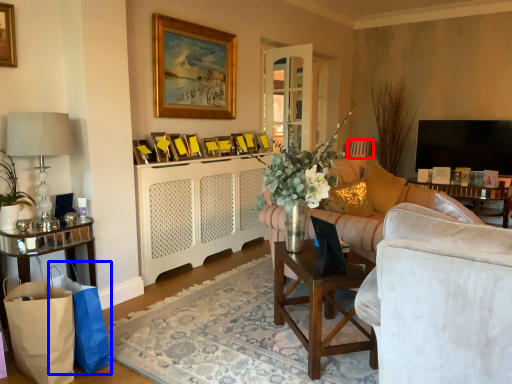
Question: Which point is further to the camera, lamp (highlighted by a red box) or shopping bag (highlighted by a blue box)?

Choices:
 (A) lamp
 (B) shopping bag

Answer: (A)